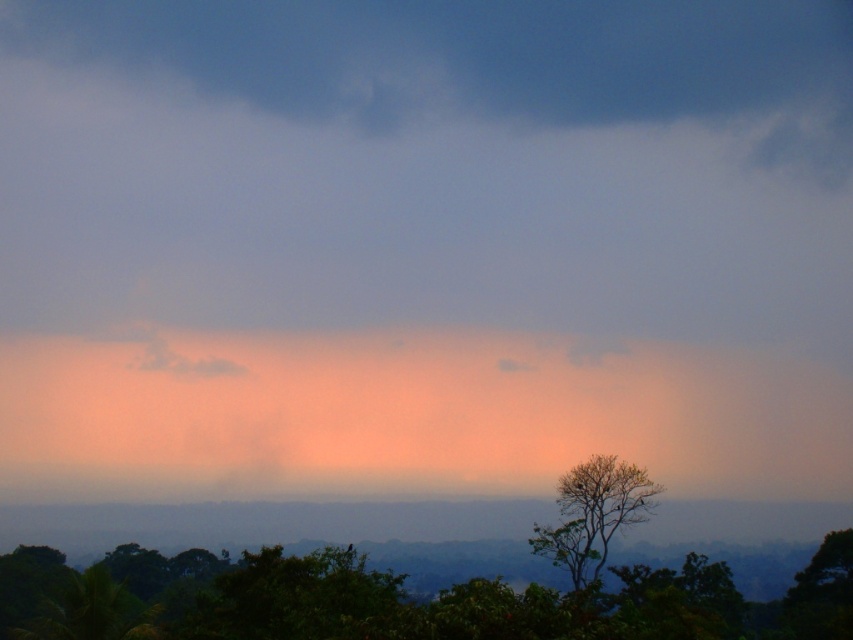
You are standing in the middle of the forest and see the green leafy tree at lower center and the green leafy tree at lower right. Which tree is positioned to the left when facing the direction of the horizon?

The green leafy tree at lower center is positioned to the left of the green leafy tree at lower right when facing the horizon direction.

You are standing in the forest and see the green leafy tree at lower center and the green leafy tree at lower right. Which tree is positioned lower in the image?

The green leafy tree at lower center is positioned lower in the image than the green leafy tree at lower right.